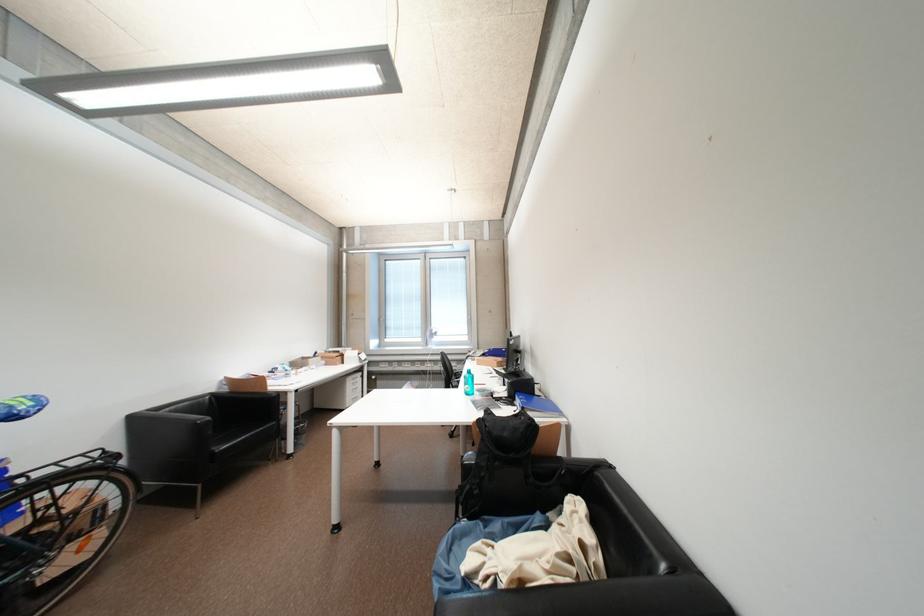
Find where to turn the window handle. Please return your answer as a coordinate pair (x, y).

(419, 299)